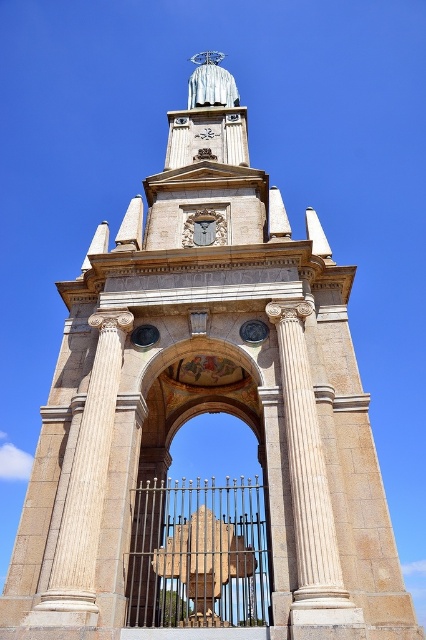
Consider the image. Between gold textured gate at center and white marble column at center, which one has less height?

white marble column at center

You are a GUI agent. You are given a task and a screenshot of the screen. Output one action in this format:
    pyautogui.click(x=<x>, y=<y>)
    Task: Click on the gold textured gate at center
    
    Given the screenshot: What is the action you would take?
    pyautogui.click(x=196, y=550)

How much distance is there between white marble column at center and wooden carving at center?

The distance of white marble column at center from wooden carving at center is 25.39 feet.

Who is shorter, white marble column at center or wooden carving at center?

wooden carving at center

I want to click on white marble column at center, so click(x=310, y=493).

The width and height of the screenshot is (426, 640). I want to click on white marble column at center, so click(310, 493).

Is gold textured gate at center closer to the viewer compared to wooden carving at center?

Yes, it is.

Can you confirm if gold textured gate at center is bigger than wooden carving at center?

Indeed, gold textured gate at center has a larger size compared to wooden carving at center.

Describe the element at coordinates (196, 550) in the screenshot. I see `gold textured gate at center` at that location.

This screenshot has height=640, width=426. I want to click on gold textured gate at center, so click(x=196, y=550).